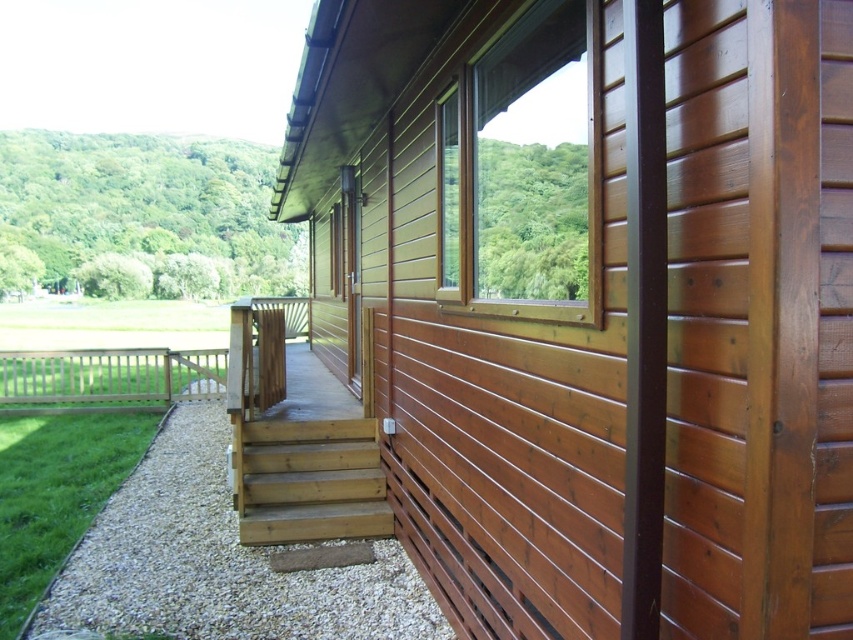
Question: Which object is closer to the camera taking this photo?

Choices:
 (A) brown wooden balustrade at left
 (B) brown wooden window at center

Answer: (B)

Question: Does brown wooden window at center come behind brown wooden balustrade at left?

Choices:
 (A) yes
 (B) no

Answer: (B)

Question: Can you confirm if brown wooden window at center is smaller than brown wooden balustrade at left?

Choices:
 (A) yes
 (B) no

Answer: (A)

Question: Estimate the real-world distances between objects in this image. Which object is closer to the white gravel at lower left?

Choices:
 (A) brown wooden balustrade at left
 (B) natural wood stairs at center

Answer: (B)

Question: Considering the relative positions of white gravel at lower left and natural wood stairs at center in the image provided, where is white gravel at lower left located with respect to natural wood stairs at center?

Choices:
 (A) below
 (B) above

Answer: (A)

Question: Which object is positioned closest to the brown wooden balustrade at left?

Choices:
 (A) natural wood stairs at center
 (B) white gravel at lower left

Answer: (A)